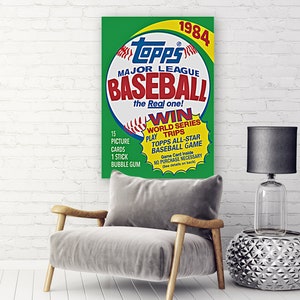
Where is `lampstand`? lampstand is located at coordinates (271, 263).